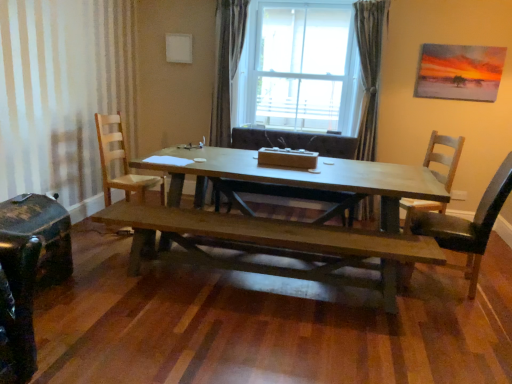
Measure the distance between wooden chair at center, placed as the third chair when sorted from right to left, and camera.

A distance of 12.37 feet exists between wooden chair at center, placed as the third chair when sorted from right to left, and camera.

Based on the photo, measure the distance between point (x=449, y=266) and camera.

Point (x=449, y=266) and camera are 3.48 meters apart from each other.

The image size is (512, 384). What do you see at coordinates (122, 162) in the screenshot?
I see `light brown wooden chair at left, acting as the 1th chair starting from the left` at bounding box center [122, 162].

What is the approximate width of satin fabric curtain at center, which is the first curtain in left-to-right order?

satin fabric curtain at center, which is the first curtain in left-to-right order, is 11.65 inches wide.

Identify the location of shiny black suitcase at lower left. The width and height of the screenshot is (512, 384). (28, 274).

Locate an element on the screen. wooden table at center is located at coordinates (298, 177).

Locate an element on the screen. Image resolution: width=512 pixels, height=384 pixels. wooden chair at right, which is counted as the third chair, starting from the left is located at coordinates (444, 157).

I want to click on satin fabric curtain at upper center, the 2th curtain when ordered from left to right, so click(x=369, y=69).

Where is `curtain that is the 2nd one when counting upward from the wooden chair at right, which is counted as the third chair, starting from the left (from the image's perspective)`? This screenshot has height=384, width=512. curtain that is the 2nd one when counting upward from the wooden chair at right, which is counted as the third chair, starting from the left (from the image's perspective) is located at coordinates (226, 66).

Between satin fabric curtain at center, the 2th curtain when ordered from right to left, and wooden chair at right, the 2th chair when ordered from right to left, which one has smaller size?

With smaller size is satin fabric curtain at center, the 2th curtain when ordered from right to left.

Is satin fabric curtain at center, which is the first curtain in left-to-right order, looking in the opposite direction of wooden chair at right, the 2th chair when ordered from right to left?

No, satin fabric curtain at center, which is the first curtain in left-to-right order,'s orientation is not away from wooden chair at right, the 2th chair when ordered from right to left.

From the image's perspective, which is above, satin fabric curtain at center, which is the first curtain in left-to-right order, or wooden chair at right, which is counted as the third chair, starting from the left?

satin fabric curtain at center, which is the first curtain in left-to-right order, appears higher in the image.

Considering the sizes of objects satin fabric curtain at upper center, the 2th curtain when ordered from left to right, and dark brown wooden bench at center in the image provided, who is shorter, satin fabric curtain at upper center, the 2th curtain when ordered from left to right, or dark brown wooden bench at center?

Standing shorter between the two is dark brown wooden bench at center.

Is satin fabric curtain at upper center, the 1th curtain in the right-to-left sequence, surrounding dark brown wooden bench at center?

No, dark brown wooden bench at center is located outside of satin fabric curtain at upper center, the 1th curtain in the right-to-left sequence.

Is satin fabric curtain at upper center, the 2th curtain when ordered from left to right, closer to camera compared to dark brown wooden bench at center?

No, it is behind dark brown wooden bench at center.

Is satin fabric curtain at upper center, the 1th curtain in the right-to-left sequence, touching dark brown wooden bench at center?

No, satin fabric curtain at upper center, the 1th curtain in the right-to-left sequence, is not making contact with dark brown wooden bench at center.

From the image's perspective, which one is positioned lower, satin fabric curtain at center, the 2th curtain when ordered from right to left, or transparent glass window at center?

satin fabric curtain at center, the 2th curtain when ordered from right to left, from the image's perspective.

Is satin fabric curtain at center, which is the first curtain in left-to-right order, facing away from transparent glass window at center?

No.

In terms of size, does satin fabric curtain at center, the 2th curtain when ordered from right to left, appear bigger or smaller than transparent glass window at center?

satin fabric curtain at center, the 2th curtain when ordered from right to left, is smaller than transparent glass window at center.

Does point (216, 14) appear closer or farther from the camera than point (338, 100)?

Point (216, 14).

From a real-world perspective, which is physically above, dark brown wooden bench at center or shiny black suitcase at lower left?

shiny black suitcase at lower left.

Does dark brown wooden bench at center turn towards shiny black suitcase at lower left?

No, dark brown wooden bench at center is not aimed at shiny black suitcase at lower left.

Considering the points (246, 268) and (4, 221), which point is in front, point (246, 268) or point (4, 221)?

The point (4, 221) is in front.

Considering the positions of objects dark brown wooden bench at center and light brown wood chair at right, the 4th chair positioned from the left, in the image provided, who is more to the left, dark brown wooden bench at center or light brown wood chair at right, the 4th chair positioned from the left,?

dark brown wooden bench at center.

Between dark brown wooden bench at center and light brown wood chair at right, which is the first chair from right to left, which one has larger size?

With larger size is dark brown wooden bench at center.

From their relative heights in the image, would you say dark brown wooden bench at center is taller or shorter than light brown wood chair at right, the 4th chair positioned from the left?

Considering their sizes, dark brown wooden bench at center has less height than light brown wood chair at right, the 4th chair positioned from the left.

Considering the sizes of objects dark brown wooden bench at center and light brown wood chair at right, which is the first chair from right to left, in the image provided, who is wider, dark brown wooden bench at center or light brown wood chair at right, which is the first chair from right to left,?

With larger width is light brown wood chair at right, which is the first chair from right to left.

Are satin fabric curtain at upper center, the 1th curtain in the right-to-left sequence, and shiny black suitcase at lower left located far from each other?

Yes.

Which is behind, satin fabric curtain at upper center, the 1th curtain in the right-to-left sequence, or shiny black suitcase at lower left?

satin fabric curtain at upper center, the 1th curtain in the right-to-left sequence, is behind.

Is point (365, 123) closer to camera compared to point (48, 244)?

No, it is behind (48, 244).

Is satin fabric curtain at upper center, the 2th curtain when ordered from left to right, to the left or to the right of shiny black suitcase at lower left in the image?

In the image, satin fabric curtain at upper center, the 2th curtain when ordered from left to right, appears on the right side of shiny black suitcase at lower left.

Which is more to the left, satin fabric curtain at upper center, the 2th curtain when ordered from left to right, or light brown wood chair at right, which is the first chair from right to left?

satin fabric curtain at upper center, the 2th curtain when ordered from left to right, is more to the left.

Is satin fabric curtain at upper center, the 2th curtain when ordered from left to right, far away from light brown wood chair at right, the 4th chair positioned from the left?

satin fabric curtain at upper center, the 2th curtain when ordered from left to right, is far away from light brown wood chair at right, the 4th chair positioned from the left.

Which object is closer to the camera taking this photo, satin fabric curtain at upper center, the 2th curtain when ordered from left to right, or light brown wood chair at right, the 4th chair positioned from the left?

light brown wood chair at right, the 4th chair positioned from the left.

Looking at this image, is satin fabric curtain at upper center, the 2th curtain when ordered from left to right, positioned beyond the bounds of light brown wood chair at right, which is the first chair from right to left?

Yes, satin fabric curtain at upper center, the 2th curtain when ordered from left to right, is located beyond the bounds of light brown wood chair at right, which is the first chair from right to left.

At what (x,y) coordinates should I click in order to perform the action: click on chair that is the 3rd one when counting downward from the satin fabric curtain at center, which is the first curtain in left-to-right order (from the image's perspective). Please return your answer as a coordinate pair (x, y). This screenshot has width=512, height=384. Looking at the image, I should click on (444, 157).

The image size is (512, 384). I want to click on the 1st curtain above when counting from the dark brown wooden bench at center (from the image's perspective), so click(369, 69).

Based on their spatial positions, is wooden chair at right, which is counted as the third chair, starting from the left, or shiny black suitcase at lower left closer to light brown wooden chair at left, acting as the 1th chair starting from the left?

Among the two, shiny black suitcase at lower left is located nearer to light brown wooden chair at left, acting as the 1th chair starting from the left.

Looking at the image, which one is located further to satin fabric curtain at upper center, the 2th curtain when ordered from left to right, wooden table at center or shiny black suitcase at lower left?

The object further to satin fabric curtain at upper center, the 2th curtain when ordered from left to right, is shiny black suitcase at lower left.

Consider the image. Which object lies further to the anchor point transparent glass window at center, satin fabric curtain at center, which is the first curtain in left-to-right order, or wooden chair at right, which is counted as the third chair, starting from the left?

The object further to transparent glass window at center is wooden chair at right, which is counted as the third chair, starting from the left.

From the image, which object appears to be nearer to satin fabric curtain at upper center, the 2th curtain when ordered from left to right, shiny black suitcase at lower left or transparent glass window at center?

transparent glass window at center is closer to satin fabric curtain at upper center, the 2th curtain when ordered from left to right.

Looking at this image, when comparing their distances from wooden table at center, does wooden chair at right, the 2th chair when ordered from right to left, or satin fabric curtain at center, which is the first curtain in left-to-right order, seem closer?

The object closer to wooden table at center is wooden chair at right, the 2th chair when ordered from right to left.

Based on the photo, considering their positions, is transparent glass window at center positioned closer to wooden chair at right, the 2th chair when ordered from right to left, than light brown wood chair at right, the 4th chair positioned from the left?

The object closer to wooden chair at right, the 2th chair when ordered from right to left, is light brown wood chair at right, the 4th chair positioned from the left.

From the image, which object appears to be nearer to wooden chair at right, the 2th chair when ordered from right to left, satin fabric curtain at upper center, the 1th curtain in the right-to-left sequence, or transparent glass window at center?

satin fabric curtain at upper center, the 1th curtain in the right-to-left sequence, is positioned closer to the anchor wooden chair at right, the 2th chair when ordered from right to left.

When comparing their distances from wooden chair at right, which is counted as the third chair, starting from the left, does satin fabric curtain at upper center, the 1th curtain in the right-to-left sequence, or shiny black suitcase at lower left seem closer?

satin fabric curtain at upper center, the 1th curtain in the right-to-left sequence, is closer to wooden chair at right, which is counted as the third chair, starting from the left.

At what (x,y) coordinates should I click in order to perform the action: click on table situated between light brown wooden chair at left, marked as the fourth chair in a right-to-left arrangement, and wooden chair at center, placed as the third chair when sorted from right to left, from left to right. Please return your answer as a coordinate pair (x, y). The height and width of the screenshot is (384, 512). Looking at the image, I should click on (298, 177).

This screenshot has height=384, width=512. I want to click on table between dark brown wooden bench at center and wooden chair at right, the 2th chair when ordered from right to left, in the horizontal direction, so click(298, 177).

Locate an element on the screen. Image resolution: width=512 pixels, height=384 pixels. curtain located between satin fabric curtain at center, the 2th curtain when ordered from right to left, and light brown wood chair at right, which is the first chair from right to left, in the left-right direction is located at coordinates (369, 69).

Image resolution: width=512 pixels, height=384 pixels. I want to click on window between shiny black suitcase at lower left and wooden chair at right, which is counted as the third chair, starting from the left, from left to right, so click(298, 68).